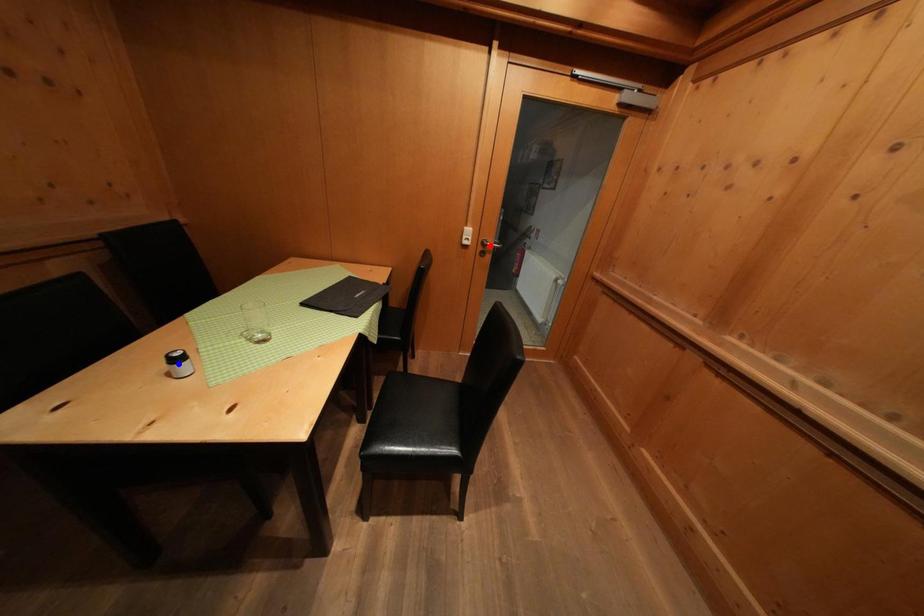
Question: Two points are marked on the image. Which point is closer to the camera?

Choices:
 (A) Blue point is closer.
 (B) Red point is closer.

Answer: (A)